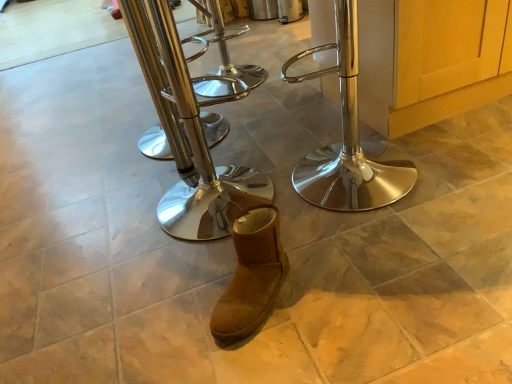
You are a GUI agent. You are given a task and a screenshot of the screen. Output one action in this format:
    pyautogui.click(x=<x>, y=<y>)
    Task: Click on the vacant region to the left of polished chrome stool at center, the second step stool viewed from the right
    The height and width of the screenshot is (384, 512).
    Given the screenshot: What is the action you would take?
    pyautogui.click(x=105, y=229)